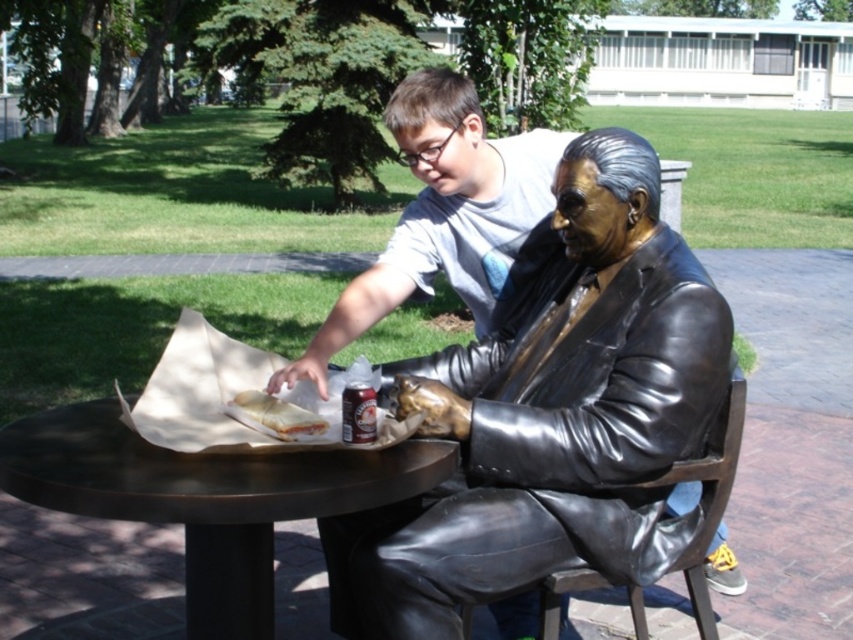
Does bronze metallic table at center have a lesser width compared to metallic silver can at table?

In fact, bronze metallic table at center might be wider than metallic silver can at table.

Which is in front, point (233, 540) or point (347, 413)?

Point (347, 413)

Is point (143, 467) in front of point (349, 444)?

Yes, point (143, 467) is in front of point (349, 444).

Where is `bronze metallic table at center`? bronze metallic table at center is located at coordinates (206, 497).

The width and height of the screenshot is (853, 640). What do you see at coordinates (550, 417) in the screenshot?
I see `bronze statue at center` at bounding box center [550, 417].

Is bronze statue at center smaller than bronze metallic table at center?

Incorrect, bronze statue at center is not smaller in size than bronze metallic table at center.

Identify the location of bronze statue at center. (550, 417).

I want to click on bronze statue at center, so click(550, 417).

Can you confirm if bronze statue at center is wider than white bread at center?

Yes.

This screenshot has height=640, width=853. What do you see at coordinates (550, 417) in the screenshot? I see `bronze statue at center` at bounding box center [550, 417].

At what (x,y) coordinates should I click in order to perform the action: click on bronze statue at center. Please return your answer as a coordinate pair (x, y). The height and width of the screenshot is (640, 853). Looking at the image, I should click on click(550, 417).